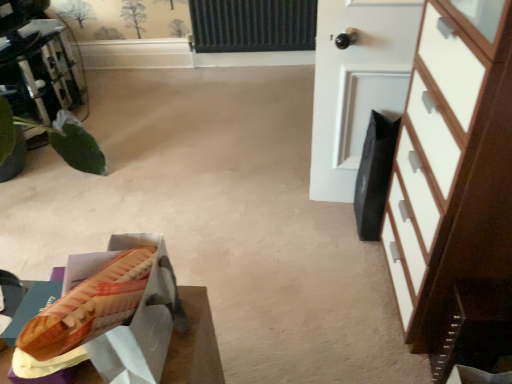
Question: Does white wood chest of drawers at right have a greater height compared to white matte door at upper right?

Choices:
 (A) no
 (B) yes

Answer: (B)

Question: Are white wood chest of drawers at right and white matte door at upper right beside each other?

Choices:
 (A) no
 (B) yes

Answer: (A)

Question: Considering the relative positions of white wood chest of drawers at right and white matte door at upper right in the image provided, is white wood chest of drawers at right to the left of white matte door at upper right from the viewer's perspective?

Choices:
 (A) yes
 (B) no

Answer: (B)

Question: Is the depth of white wood chest of drawers at right less than that of white matte door at upper right?

Choices:
 (A) no
 (B) yes

Answer: (B)

Question: Considering the relative sizes of white wood chest of drawers at right and white matte door at upper right in the image provided, is white wood chest of drawers at right smaller than white matte door at upper right?

Choices:
 (A) yes
 (B) no

Answer: (B)

Question: Is green leafy plant at left taller or shorter than white wood chest of drawers at right?

Choices:
 (A) tall
 (B) short

Answer: (B)

Question: In the image, is green leafy plant at left on the left side or the right side of white wood chest of drawers at right?

Choices:
 (A) right
 (B) left

Answer: (B)

Question: In the image, is green leafy plant at left positioned in front of or behind white wood chest of drawers at right?

Choices:
 (A) behind
 (B) front

Answer: (A)

Question: From a real-world perspective, is green leafy plant at left positioned above or below white wood chest of drawers at right?

Choices:
 (A) above
 (B) below

Answer: (B)

Question: Is white matte door at upper right wider or thinner than white wood chest of drawers at right?

Choices:
 (A) thin
 (B) wide

Answer: (A)

Question: Do you think white matte door at upper right is within white wood chest of drawers at right, or outside of it?

Choices:
 (A) inside
 (B) outside

Answer: (B)

Question: From a real-world perspective, relative to white wood chest of drawers at right, is white matte door at upper right vertically above or below?

Choices:
 (A) above
 (B) below

Answer: (B)

Question: Based on their positions, is white matte door at upper right located to the left or right of white wood chest of drawers at right?

Choices:
 (A) left
 (B) right

Answer: (A)

Question: From the image's perspective, is white matte door at upper right positioned above or below matte brown hot dog bun at lower left?

Choices:
 (A) below
 (B) above

Answer: (B)

Question: Is point (352, 137) closer or farther from the camera than point (122, 314)?

Choices:
 (A) closer
 (B) farther

Answer: (B)